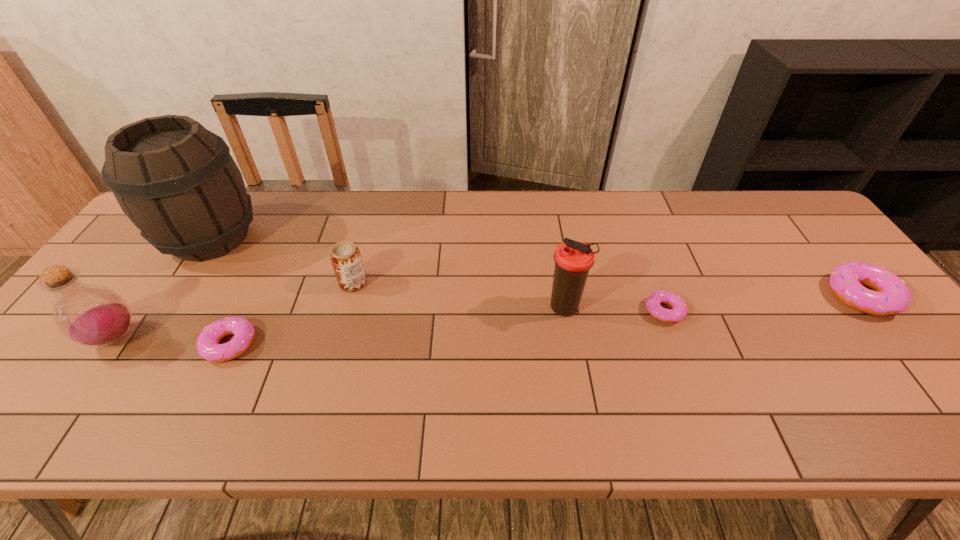
Where is `the second tallest doughnut`? The height and width of the screenshot is (540, 960). the second tallest doughnut is located at coordinates (207, 345).

Identify the location of the sixth tallest object. (207, 345).

Find the location of a particular element. the shortest doughnut is located at coordinates (679, 309).

You are a GUI agent. You are given a task and a screenshot of the screen. Output one action in this format:
    pyautogui.click(x=<x>, y=<y>)
    Task: Click on the shortest object
    
    Given the screenshot: What is the action you would take?
    pyautogui.click(x=679, y=309)

At what (x,y) coordinates should I click in order to perform the action: click on the rightmost doughnut. Please return your answer as a coordinate pair (x, y). This screenshot has width=960, height=540. Looking at the image, I should click on (891, 295).

At what (x,y) coordinates should I click in order to perform the action: click on the tallest doughnut. Please return your answer as a coordinate pair (x, y). Looking at the image, I should click on (891, 295).

You are a GUI agent. You are given a task and a screenshot of the screen. Output one action in this format:
    pyautogui.click(x=<x>, y=<y>)
    Task: Click on the wine bucket
    
    Given the screenshot: What is the action you would take?
    pyautogui.click(x=176, y=181)

This screenshot has width=960, height=540. I want to click on beer can, so click(x=346, y=260).

Locate an element on the screen. the fourth object from left to right is located at coordinates (346, 260).

Locate an element on the screen. thermos bottle is located at coordinates (573, 259).